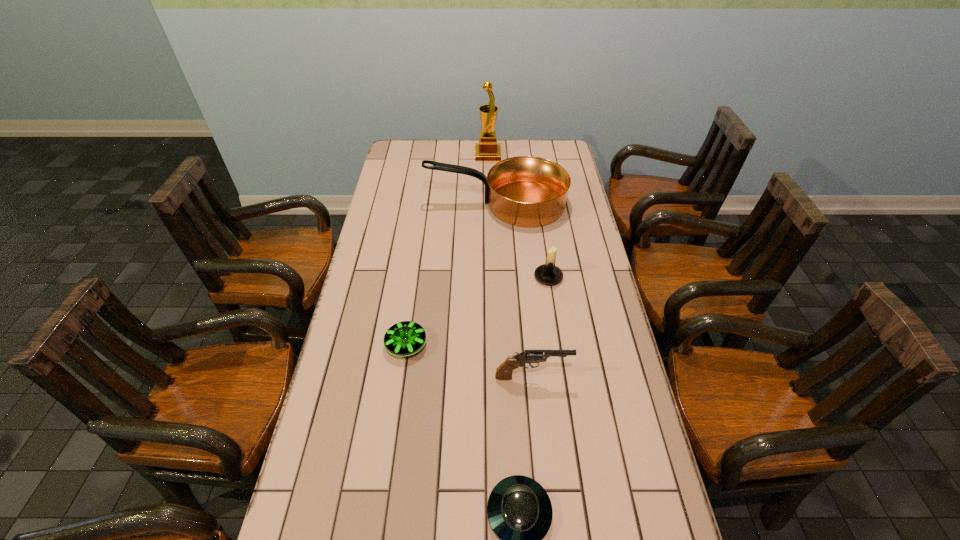
At what (x,y) coordinates should I click in order to perform the action: click on object at the left edge. Please return your answer as a coordinate pair (x, y). This screenshot has width=960, height=540. Looking at the image, I should click on (405, 338).

In order to click on frying pan that is at the right edge in this screenshot , I will do `click(526, 191)`.

What are the coordinates of `candle holder located in the right edge section of the desktop` in the screenshot? It's located at (549, 274).

This screenshot has width=960, height=540. Find the location of `free space at the far edge`. free space at the far edge is located at coordinates (453, 150).

Locate an element on the screen. The width and height of the screenshot is (960, 540). free space at the left edge is located at coordinates (415, 204).

Identify the location of vacant space at the right edge of the desktop. This screenshot has width=960, height=540. (623, 516).

In the image, there is a desktop. At what (x,y) coordinates should I click in order to perform the action: click on vacant space at the far right corner. Please return your answer as a coordinate pair (x, y). Looking at the image, I should click on (554, 141).

Where is `empty space that is in between the fourth tallest object and the third tallest object`? This screenshot has height=540, width=960. empty space that is in between the fourth tallest object and the third tallest object is located at coordinates (540, 327).

This screenshot has height=540, width=960. Identify the location of free space that is in between the fourth shortest object and the third shortest object. (540, 327).

You are a GUI agent. You are given a task and a screenshot of the screen. Output one action in this format:
    pyautogui.click(x=<x>, y=<y>)
    Task: Click on the vacant space that's between the fifth tallest object and the frying pan
    The width and height of the screenshot is (960, 540).
    Given the screenshot: What is the action you would take?
    pyautogui.click(x=451, y=274)